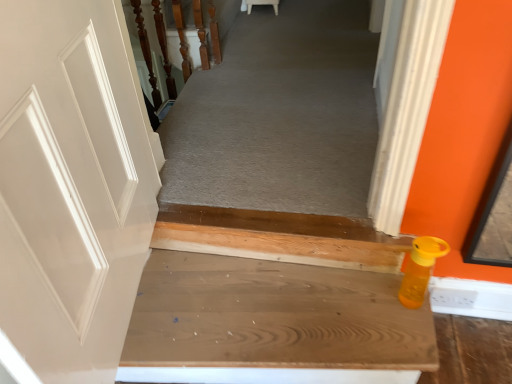
Question: Is orange matte bottle at lower right facing towards wooden stairs at lower right?

Choices:
 (A) yes
 (B) no

Answer: (B)

Question: Can you confirm if orange matte bottle at lower right is positioned to the left of wooden stairs at lower right?

Choices:
 (A) yes
 (B) no

Answer: (B)

Question: Does orange matte bottle at lower right come behind wooden stairs at lower right?

Choices:
 (A) yes
 (B) no

Answer: (A)

Question: From a real-world perspective, is orange matte bottle at lower right under wooden stairs at lower right?

Choices:
 (A) no
 (B) yes

Answer: (A)

Question: Is orange matte bottle at lower right shorter than wooden stairs at lower right?

Choices:
 (A) yes
 (B) no

Answer: (B)

Question: Is wooden stairs at lower right surrounded by orange matte bottle at lower right?

Choices:
 (A) no
 (B) yes

Answer: (A)

Question: Can we say wooden at upper left lies outside wooden stairs at lower right?

Choices:
 (A) no
 (B) yes

Answer: (B)

Question: Is wooden stairs at lower right a part of wooden at upper left?

Choices:
 (A) no
 (B) yes

Answer: (A)

Question: From a real-world perspective, is wooden at upper left over wooden stairs at lower right?

Choices:
 (A) no
 (B) yes

Answer: (B)

Question: Does wooden at upper left have a larger size compared to wooden stairs at lower right?

Choices:
 (A) yes
 (B) no

Answer: (B)

Question: Is wooden at upper left facing away from wooden stairs at lower right?

Choices:
 (A) yes
 (B) no

Answer: (B)

Question: Considering the relative positions of wooden at upper left and wooden stairs at lower right in the image provided, is wooden at upper left to the right of wooden stairs at lower right from the viewer's perspective?

Choices:
 (A) no
 (B) yes

Answer: (A)

Question: Is wooden at upper left at the back of orange matte bottle at lower right?

Choices:
 (A) yes
 (B) no

Answer: (B)